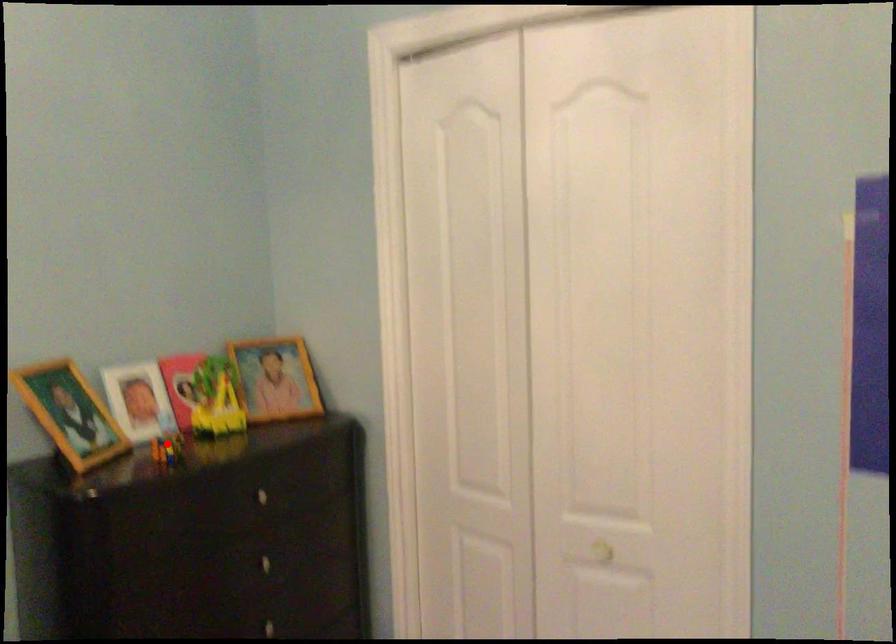
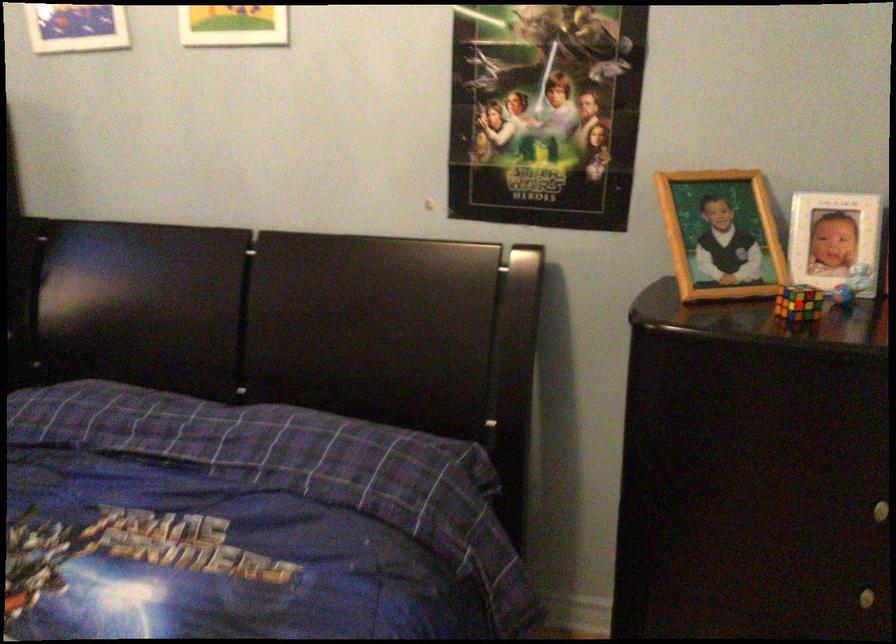
I am providing you with two images of the same scene from different viewpoints. A red point is marked on the first image and another point is marked on the second image. Is the red point in image1 aligned with the point shown in image2?

Yes